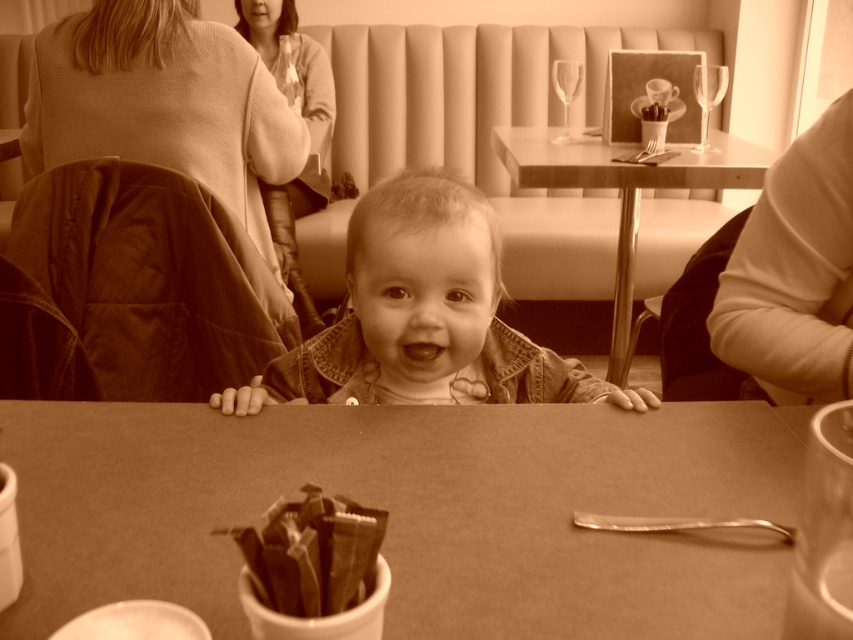
Question: Does denim jacket at center have a lesser width compared to smooth wood table at center?

Choices:
 (A) yes
 (B) no

Answer: (A)

Question: Which point is closer to the camera?

Choices:
 (A) (381, 280)
 (B) (436, 454)

Answer: (B)

Question: Among these points, which one is farthest from the camera?

Choices:
 (A) (323, 396)
 (B) (746, 182)

Answer: (B)

Question: Considering the relative positions of smooth brown table at center and dark brown textured packets at center in the image provided, where is smooth brown table at center located with respect to dark brown textured packets at center?

Choices:
 (A) below
 (B) above

Answer: (A)

Question: Observing the image, what is the correct spatial positioning of denim jacket at center in reference to smooth wood table at center?

Choices:
 (A) below
 (B) above

Answer: (A)

Question: Based on their relative distances, which object is farther from the denim jacket at center?

Choices:
 (A) smooth brown table at center
 (B) smooth wood table at center

Answer: (B)